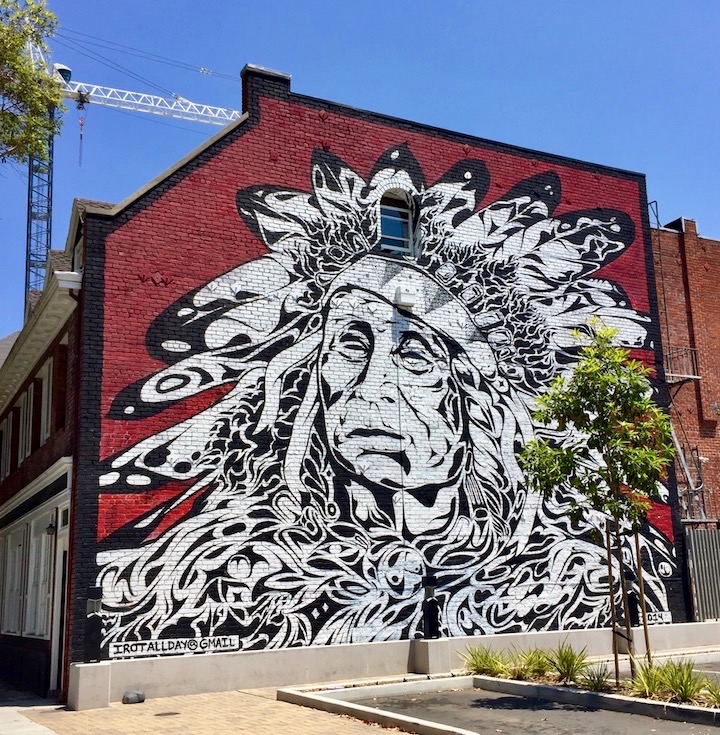
Where is `window`? This screenshot has height=735, width=720. window is located at coordinates (42, 570).